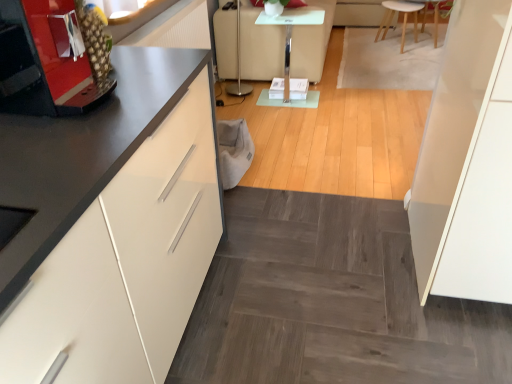
This screenshot has width=512, height=384. What do you see at coordinates (290, 36) in the screenshot?
I see `clear glass table at center` at bounding box center [290, 36].

Find the location of a particular element. The width and height of the screenshot is (512, 384). metallic red coffee machine at left is located at coordinates (56, 60).

At what (x,y) coordinates should I click in order to perform the action: click on clear glass table at center. Please return your answer as a coordinate pair (x, y). This screenshot has width=512, height=384. Looking at the image, I should click on (290, 36).

Is metallic red coffee machine at left completely or partially outside of white leather couch at center?

Yes, metallic red coffee machine at left is outside of white leather couch at center.

Looking at this image, from a real-world perspective, between metallic red coffee machine at left and white leather couch at center, who is vertically higher?

metallic red coffee machine at left.

Between metallic red coffee machine at left and white leather couch at center, which one has less height?

Standing shorter between the two is metallic red coffee machine at left.

Which of these two, light wood stool at upper right or white leather couch at center, is bigger?

With larger size is white leather couch at center.

Consider the image. From a real-world perspective, is light wood stool at upper right positioned under white leather couch at center based on gravity?

Yes, from a real-world perspective, light wood stool at upper right is beneath white leather couch at center.

Is light wood stool at upper right turned away from white leather couch at center?

Correct, light wood stool at upper right is looking away from white leather couch at center.

Considering the relative positions of light wood stool at upper right and white leather couch at center in the image provided, is light wood stool at upper right to the right of white leather couch at center from the viewer's perspective?

Yes.

From the image's perspective, does white leather couch at center appear lower than clear glass table at center?

Incorrect, from the image's perspective, white leather couch at center is higher than clear glass table at center.

Which of these two, white leather couch at center or clear glass table at center, stands taller?

white leather couch at center is taller.

Is white leather couch at center positioned beyond the bounds of clear glass table at center?

Yes, white leather couch at center is located beyond the bounds of clear glass table at center.

Can you tell me how much white leather couch at center and clear glass table at center differ in facing direction?

The facing directions of white leather couch at center and clear glass table at center are 0.552 degrees apart.

Which point is more distant from viewer, (414, 12) or (262, 13)?

Point (414, 12)

From a real-world perspective, which is physically above, light wood stool at upper right or clear glass table at center?

From a 3D spatial view, clear glass table at center is above.

Does light wood stool at upper right touch clear glass table at center?

No, light wood stool at upper right is not beside clear glass table at center.

Looking at this image, does light wood stool at upper right have a larger size compared to clear glass table at center?

Correct, light wood stool at upper right is larger in size than clear glass table at center.

From the image's perspective, which one is positioned higher, metallic red coffee machine at left or light wood stool at upper right?

light wood stool at upper right is shown above in the image.

Does metallic red coffee machine at left appear on the left side of light wood stool at upper right?

Yes.

Between metallic red coffee machine at left and light wood stool at upper right, which one has smaller size?

metallic red coffee machine at left is smaller.

Is metallic red coffee machine at left aimed at light wood stool at upper right?

No.

From the image's perspective, is white leather couch at center positioned above or below light wood stool at upper right?

From the image's perspective, white leather couch at center appears below light wood stool at upper right.

Between white leather couch at center and light wood stool at upper right, which one appears on the right side from the viewer's perspective?

light wood stool at upper right is more to the right.

Considering the sizes of white leather couch at center and light wood stool at upper right in the image, is white leather couch at center wider or thinner than light wood stool at upper right?

white leather couch at center is wider than light wood stool at upper right.

Which of these two, white leather couch at center or light wood stool at upper right, is smaller?

With smaller size is light wood stool at upper right.

Considering the positions of point (246, 11) and point (65, 91), is point (246, 11) closer or farther from the camera than point (65, 91)?

Point (246, 11) appears to be farther away from the viewer than point (65, 91).

From the image's perspective, is white leather couch at center above metallic red coffee machine at left?

Indeed, from the image's perspective, white leather couch at center is shown above metallic red coffee machine at left.

Does white leather couch at center appear on the right side of metallic red coffee machine at left?

Yes.

From the picture: Is white leather couch at center oriented towards metallic red coffee machine at left?

No, white leather couch at center is not aimed at metallic red coffee machine at left.

Image resolution: width=512 pixels, height=384 pixels. Find the location of `couch on the right side of metallic red coffee machine at left`. couch on the right side of metallic red coffee machine at left is located at coordinates (260, 46).

This screenshot has height=384, width=512. Identify the location of couch located below the light wood stool at upper right (from the image's perspective). (260, 46).

Which object lies further to the anchor point metallic red coffee machine at left, clear glass table at center or white leather couch at center?

Among the two, white leather couch at center is located further to metallic red coffee machine at left.

Consider the image. Looking at the image, which one is located closer to light wood stool at upper right, clear glass table at center or white leather couch at center?

clear glass table at center.

Considering their positions, is clear glass table at center positioned closer to white leather couch at center than light wood stool at upper right?

Among the two, clear glass table at center is located nearer to white leather couch at center.

From the image, which object appears to be nearer to white leather couch at center, metallic red coffee machine at left or light wood stool at upper right?

light wood stool at upper right is positioned closer to the anchor white leather couch at center.

Considering their positions, is metallic red coffee machine at left positioned closer to white leather couch at center than clear glass table at center?

clear glass table at center is positioned closer to the anchor white leather couch at center.

Estimate the real-world distances between objects in this image. Which object is closer to metallic red coffee machine at left, white leather couch at center or clear glass table at center?

clear glass table at center is positioned closer to the anchor metallic red coffee machine at left.

Based on their spatial positions, is clear glass table at center or metallic red coffee machine at left closer to light wood stool at upper right?

clear glass table at center is closer to light wood stool at upper right.

From the image, which object appears to be farther from clear glass table at center, metallic red coffee machine at left or light wood stool at upper right?

metallic red coffee machine at left is further to clear glass table at center.

What are the coordinates of `table between metallic red coffee machine at left and white leather couch at center in the front-back direction` in the screenshot? It's located at (290, 36).

I want to click on couch between clear glass table at center and light wood stool at upper right in the horizontal direction, so click(260, 46).

At what (x,y) coordinates should I click in order to perform the action: click on table between metallic red coffee machine at left and light wood stool at upper right along the z-axis. Please return your answer as a coordinate pair (x, y). Looking at the image, I should click on (290, 36).

Where is `couch located between metallic red coffee machine at left and light wood stool at upper right in the depth direction`? This screenshot has width=512, height=384. couch located between metallic red coffee machine at left and light wood stool at upper right in the depth direction is located at coordinates (260, 46).